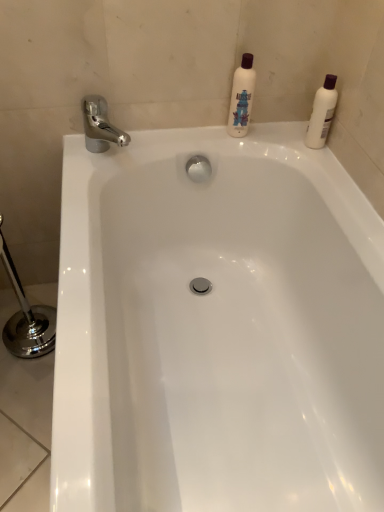
Question: Is white plastic bottle at upper right, positioned as the 1th cleaning product in right-to-left order, positioned with its back to white glossy bathtub at center?

Choices:
 (A) yes
 (B) no

Answer: (B)

Question: Considering the relative positions of white plastic bottle at upper right, which is the 2th cleaning product from left to right, and white glossy bathtub at center in the image provided, is white plastic bottle at upper right, which is the 2th cleaning product from left to right, in front of white glossy bathtub at center?

Choices:
 (A) yes
 (B) no

Answer: (B)

Question: Does white plastic bottle at upper right, positioned as the 1th cleaning product in right-to-left order, have a greater width compared to white glossy bathtub at center?

Choices:
 (A) yes
 (B) no

Answer: (B)

Question: Does white plastic bottle at upper right, positioned as the 1th cleaning product in right-to-left order, touch white glossy bathtub at center?

Choices:
 (A) yes
 (B) no

Answer: (B)

Question: Can we say white plastic bottle at upper right, which is the 2th cleaning product from left to right, lies outside white glossy bathtub at center?

Choices:
 (A) yes
 (B) no

Answer: (A)

Question: From a real-world perspective, relative to white plastic bottle at upper right, positioned as the 1th cleaning product in right-to-left order, is white matte bottle at upper center, which is the 1th cleaning product in left-to-right order, vertically above or below?

Choices:
 (A) above
 (B) below

Answer: (A)

Question: Based on their sizes in the image, would you say white matte bottle at upper center, which is the 1th cleaning product in left-to-right order, is bigger or smaller than white plastic bottle at upper right, positioned as the 1th cleaning product in right-to-left order?

Choices:
 (A) small
 (B) big

Answer: (B)

Question: Do you think white matte bottle at upper center, which is the 1th cleaning product in left-to-right order, is within white plastic bottle at upper right, which is the 2th cleaning product from left to right, or outside of it?

Choices:
 (A) inside
 (B) outside

Answer: (B)

Question: Considering the positions of point (236, 116) and point (311, 129), is point (236, 116) closer or farther from the camera than point (311, 129)?

Choices:
 (A) farther
 (B) closer

Answer: (A)

Question: From a real-world perspective, is chrome metallic faucet at upper left positioned above or below white glossy bathtub at center?

Choices:
 (A) above
 (B) below

Answer: (A)

Question: In the image, is chrome metallic faucet at upper left positioned in front of or behind white glossy bathtub at center?

Choices:
 (A) front
 (B) behind

Answer: (B)

Question: From the image's perspective, is chrome metallic faucet at upper left positioned above or below white glossy bathtub at center?

Choices:
 (A) above
 (B) below

Answer: (A)

Question: Is point (100, 132) positioned closer to the camera than point (139, 412)?

Choices:
 (A) closer
 (B) farther

Answer: (B)

Question: Is point (112, 269) closer or farther from the camera than point (241, 128)?

Choices:
 (A) closer
 (B) farther

Answer: (B)

Question: Is white glossy bathtub at center wider or thinner than white matte bottle at upper center, which is the 2th cleaning product in right-to-left order?

Choices:
 (A) wide
 (B) thin

Answer: (A)